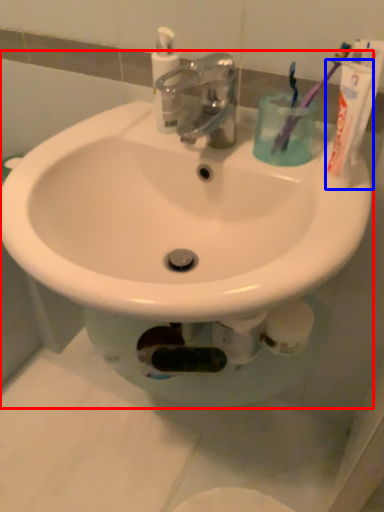
Question: Which object appears farthest to the camera in this image, sink (highlighted by a red box) or toothpaste (highlighted by a blue box)?

Choices:
 (A) sink
 (B) toothpaste

Answer: (B)